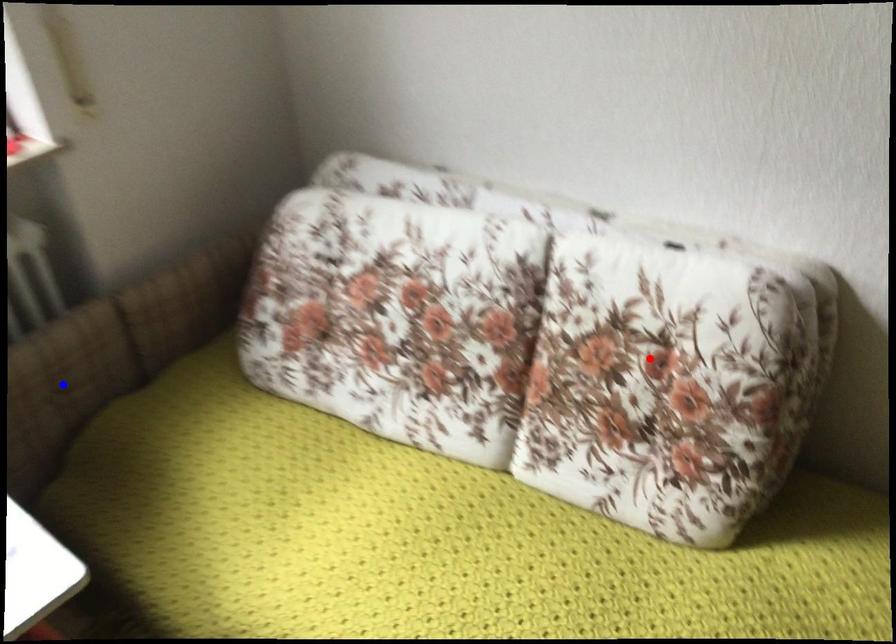
Question: Which of the two points in the image is closer to the camera?

Choices:
 (A) Blue point is closer.
 (B) Red point is closer.

Answer: (B)